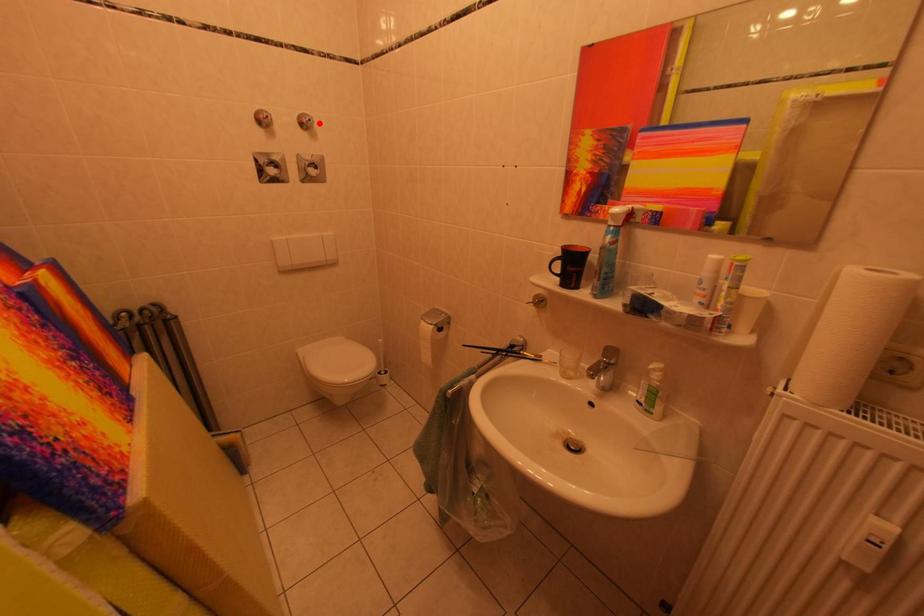
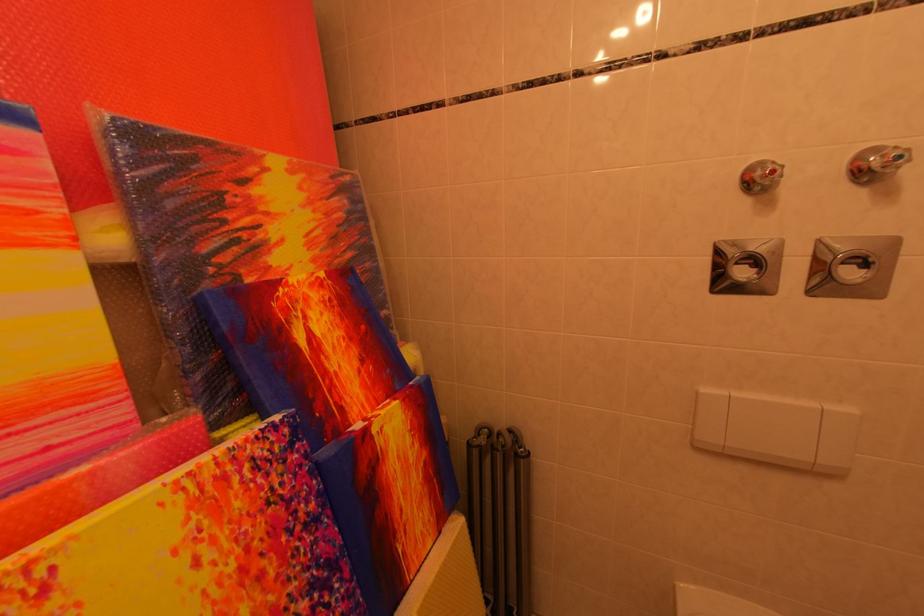
Locate, in the second image, the point that corresponds to the highlighted location in the first image.

(907, 161)